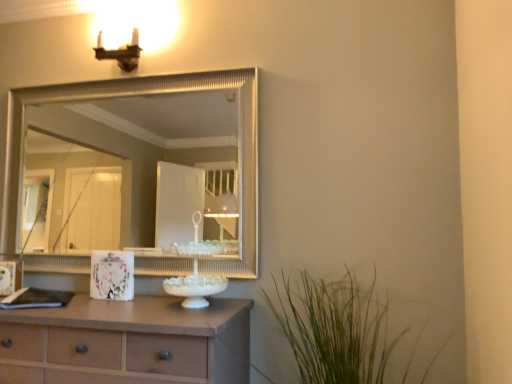
In order to click on free space in front of white glossy picture frame at center in this screenshot , I will do `click(102, 309)`.